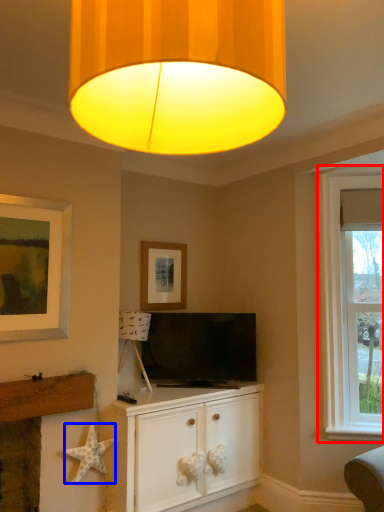
Question: Which point is further to the camera, window (highlighted by a red box) or starfish (highlighted by a blue box)?

Choices:
 (A) window
 (B) starfish

Answer: (A)